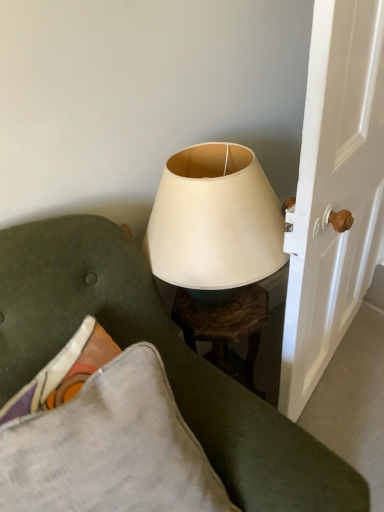
Question: From the image's perspective, is textured gray pillow at lower left over white glossy door handle at right?

Choices:
 (A) no
 (B) yes

Answer: (A)

Question: From a real-world perspective, is textured gray pillow at lower left located beneath white glossy door handle at right?

Choices:
 (A) yes
 (B) no

Answer: (A)

Question: Is textured gray pillow at lower left taller than white glossy door handle at right?

Choices:
 (A) no
 (B) yes

Answer: (A)

Question: Is textured gray pillow at lower left smaller than white glossy door handle at right?

Choices:
 (A) yes
 (B) no

Answer: (A)

Question: Is textured gray pillow at lower left at the right side of white glossy door handle at right?

Choices:
 (A) no
 (B) yes

Answer: (A)

Question: Can you confirm if textured gray pillow at lower left is positioned to the left of white glossy door handle at right?

Choices:
 (A) yes
 (B) no

Answer: (A)

Question: Does white glossy door handle at right have a larger size compared to matte white lampshade at upper center?

Choices:
 (A) no
 (B) yes

Answer: (B)

Question: Does white glossy door handle at right have a lesser height compared to matte white lampshade at upper center?

Choices:
 (A) no
 (B) yes

Answer: (A)

Question: Considering the relative sizes of white glossy door handle at right and matte white lampshade at upper center in the image provided, is white glossy door handle at right taller than matte white lampshade at upper center?

Choices:
 (A) yes
 (B) no

Answer: (A)

Question: Is white glossy door handle at right facing towards matte white lampshade at upper center?

Choices:
 (A) yes
 (B) no

Answer: (B)

Question: Is white glossy door handle at right not close to matte white lampshade at upper center?

Choices:
 (A) yes
 (B) no

Answer: (B)

Question: Can you confirm if white glossy door handle at right is wider than matte white lampshade at upper center?

Choices:
 (A) yes
 (B) no

Answer: (B)

Question: Is matte white lampshade at upper center taller than white glossy door handle at right?

Choices:
 (A) yes
 (B) no

Answer: (B)